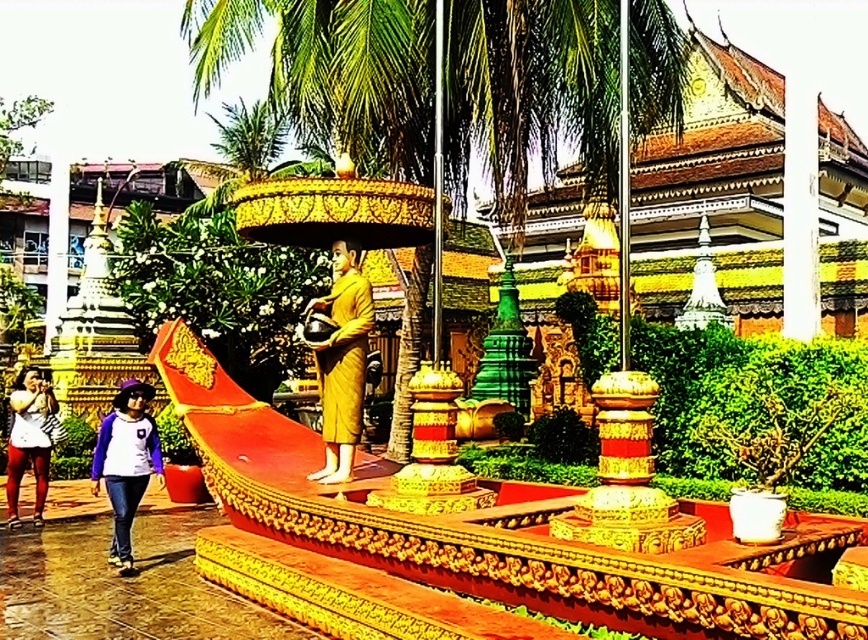
You are an architect designing a new temple layout. You need to place the golden polished boat at center and the white cotton shirt at lower left in such a way that they are visible from the main entrance. Given their positions, which object would be more likely to block the view of the other from the entrance?

The golden polished boat at center is located above the white cotton shirt at lower left, so the boat would block the view of the shirt from the entrance.

You are an architect designing a new temple layout. You need to place a yellow matte statue at center and a matte white shirt at lower left in such a way that they do not block each other. Based on the scene description, is this arrangement possible?

The yellow matte statue at center is positioned over the matte white shirt at lower left, meaning they are stacked vertically. Since they are not placed side by side, they won not block each other from view if positioned appropriately in the temple layout.